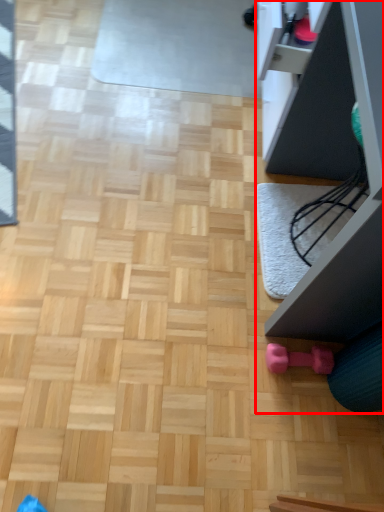
Question: From the image's perspective, where is furniture (annotated by the red box) located in relation to toy in the image?

Choices:
 (A) above
 (B) below

Answer: (A)